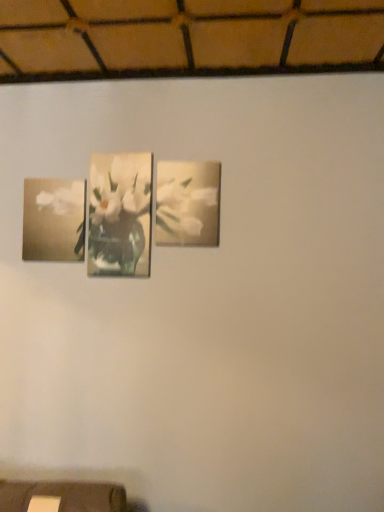
The width and height of the screenshot is (384, 512). I want to click on matte floral print at left, placed as the 2th picture frame when sorted from right to left, so click(54, 220).

Identify the location of matte floral print at center. The width and height of the screenshot is (384, 512). (120, 188).

What are the coordinates of `matte floral print at left, which is the 1th picture frame in left-to-right order` in the screenshot? It's located at [54, 220].

Does point (45, 256) lie behind point (155, 220)?

Yes.

Is matte floral print at left, which is the 1th picture frame in left-to-right order, oriented towards matte floral print at center, which is the 2th picture frame from left to right?

No, matte floral print at left, which is the 1th picture frame in left-to-right order, is not oriented towards matte floral print at center, which is the 2th picture frame from left to right.

Between matte floral print at left, which is the 1th picture frame in left-to-right order, and matte floral print at center, which is the 2th picture frame from left to right, which one has more height?

matte floral print at center, which is the 2th picture frame from left to right.

Looking at the image, does matte floral print at center, which is the 2th picture frame from left to right, seem bigger or smaller compared to matte floral print at left, placed as the 2th picture frame when sorted from right to left?

In the image, matte floral print at center, which is the 2th picture frame from left to right, appears to be smaller than matte floral print at left, placed as the 2th picture frame when sorted from right to left.

Which object is closer to the camera taking this photo, matte floral print at center, the first picture frame from the right, or matte floral print at left, which is the 1th picture frame in left-to-right order?

matte floral print at center, the first picture frame from the right, is more forward.

Could you measure the distance between matte floral print at center, which is the 2th picture frame from left to right, and matte floral print at left, placed as the 2th picture frame when sorted from right to left?

matte floral print at center, which is the 2th picture frame from left to right, is 20.14 inches away from matte floral print at left, placed as the 2th picture frame when sorted from right to left.

Based on the photo, is matte floral print at center, the first picture frame from the right, aimed at matte floral print at left, which is the 1th picture frame in left-to-right order?

No, matte floral print at center, the first picture frame from the right, is not facing towards matte floral print at left, which is the 1th picture frame in left-to-right order.

From a real-world perspective, which is physically below, matte floral print at center, which is the 2th picture frame from left to right, or matte floral print at center?

From a 3D spatial view, matte floral print at center is below.

Is matte floral print at center, the first picture frame from the right, facing towards matte floral print at center?

No, matte floral print at center, the first picture frame from the right, does not turn towards matte floral print at center.

Is matte floral print at center, the first picture frame from the right, bigger than matte floral print at center?

No, matte floral print at center, the first picture frame from the right, is not bigger than matte floral print at center.

Is matte floral print at left, which is the 1th picture frame in left-to-right order, oriented away from matte floral print at center?

matte floral print at left, which is the 1th picture frame in left-to-right order, is not turned away from matte floral print at center.

Would you say matte floral print at left, which is the 1th picture frame in left-to-right order, is to the left or to the right of matte floral print at center in the picture?

From the image, it's evident that matte floral print at left, which is the 1th picture frame in left-to-right order, is to the left of matte floral print at center.

How different are the orientations of matte floral print at left, which is the 1th picture frame in left-to-right order, and matte floral print at center in degrees?

The facing directions of matte floral print at left, which is the 1th picture frame in left-to-right order, and matte floral print at center are 0.174 degrees apart.

Which is less distant, (64, 234) or (120, 172)?

The point (120, 172) is more forward.

Is matte floral print at center to the left of matte floral print at center, the first picture frame from the right, from the viewer's perspective?

Yes, matte floral print at center is to the left of matte floral print at center, the first picture frame from the right.

Is matte floral print at center not within matte floral print at center, the first picture frame from the right?

matte floral print at center lies outside matte floral print at center, the first picture frame from the right,'s area.

Does point (137, 181) come in front of point (155, 228)?

No, (137, 181) is further to viewer.

Is matte floral print at left, which is the 1th picture frame in left-to-right order, surrounded by matte floral print at center?

No, matte floral print at left, which is the 1th picture frame in left-to-right order, is not a part of matte floral print at center.

Looking at this image, could you tell me if matte floral print at center is turned towards matte floral print at left, placed as the 2th picture frame when sorted from right to left?

No, matte floral print at center is not turned towards matte floral print at left, placed as the 2th picture frame when sorted from right to left.

How many degrees apart are the facing directions of matte floral print at center and matte floral print at left, placed as the 2th picture frame when sorted from right to left?

0.174 degrees.

The image size is (384, 512). I want to click on flower in front of the matte floral print at left, which is the 1th picture frame in left-to-right order, so click(120, 188).

Locate an element on the screen. Image resolution: width=384 pixels, height=512 pixels. picture frame lying below the matte floral print at center, the first picture frame from the right (from the image's perspective) is located at coordinates (54, 220).

This screenshot has height=512, width=384. In the image, there is a matte floral print at center, the first picture frame from the right. Identify the location of picture frame below it (from a real-world perspective). (54, 220).

Looking at the image, which one is located closer to matte floral print at center, the first picture frame from the right, matte floral print at center or matte floral print at left, which is the 1th picture frame in left-to-right order?

matte floral print at center is positioned closer to the anchor matte floral print at center, the first picture frame from the right.

Estimate the real-world distances between objects in this image. Which object is further from matte floral print at left, placed as the 2th picture frame when sorted from right to left, matte floral print at center or matte floral print at center, which is the 2th picture frame from left to right?

matte floral print at center, which is the 2th picture frame from left to right, lies further to matte floral print at left, placed as the 2th picture frame when sorted from right to left, than the other object.

Looking at the image, which one is located further to matte floral print at center, the first picture frame from the right, matte floral print at left, placed as the 2th picture frame when sorted from right to left, or matte floral print at center?

matte floral print at left, placed as the 2th picture frame when sorted from right to left.

Which object lies nearer to the anchor point matte floral print at center, matte floral print at center, the first picture frame from the right, or matte floral print at left, which is the 1th picture frame in left-to-right order?

matte floral print at center, the first picture frame from the right, is positioned closer to the anchor matte floral print at center.

Considering their positions, is matte floral print at center, the first picture frame from the right, positioned closer to matte floral print at left, placed as the 2th picture frame when sorted from right to left, than matte floral print at center?

matte floral print at center.

Which object lies nearer to the anchor point matte floral print at center, matte floral print at left, which is the 1th picture frame in left-to-right order, or matte floral print at center, the first picture frame from the right?

Based on the image, matte floral print at center, the first picture frame from the right, appears to be nearer to matte floral print at center.

I want to click on flower situated between matte floral print at left, which is the 1th picture frame in left-to-right order, and matte floral print at center, which is the 2th picture frame from left to right, from left to right, so click(x=120, y=188).